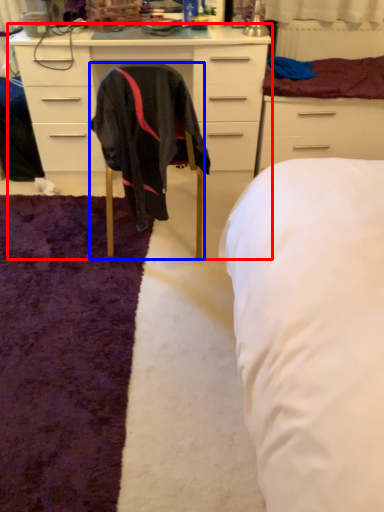
Question: Among these objects, which one is farthest to the camera, cabinetry (highlighted by a red box) or chair (highlighted by a blue box)?

Choices:
 (A) cabinetry
 (B) chair

Answer: (A)